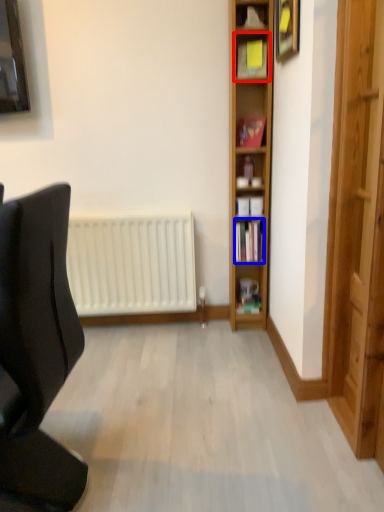
Question: Which point is closer to the camera, shelf (highlighted by a red box) or book (highlighted by a blue box)?

Choices:
 (A) shelf
 (B) book

Answer: (A)